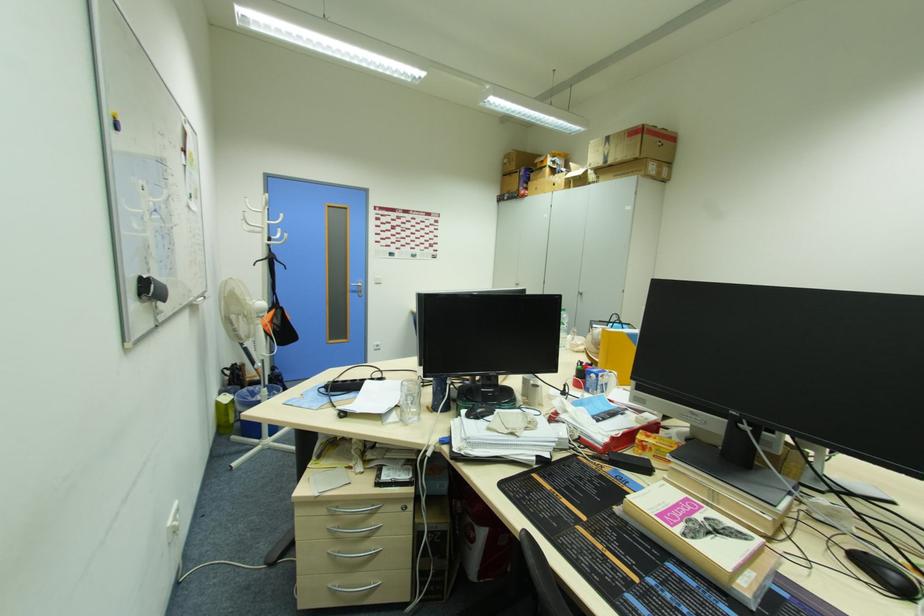
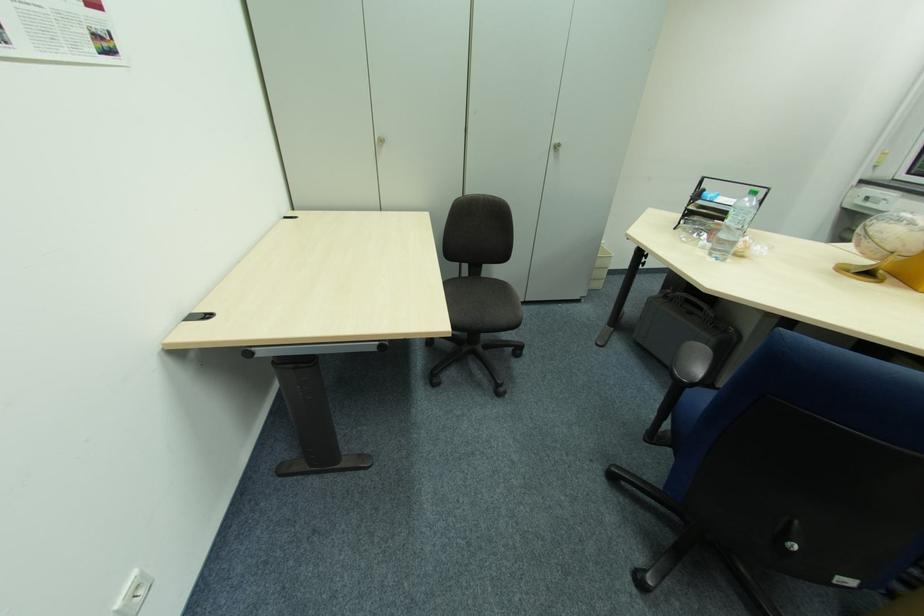
The point at (x=582, y=296) is marked in the first image. Where is the corresponding point in the second image?

(554, 150)